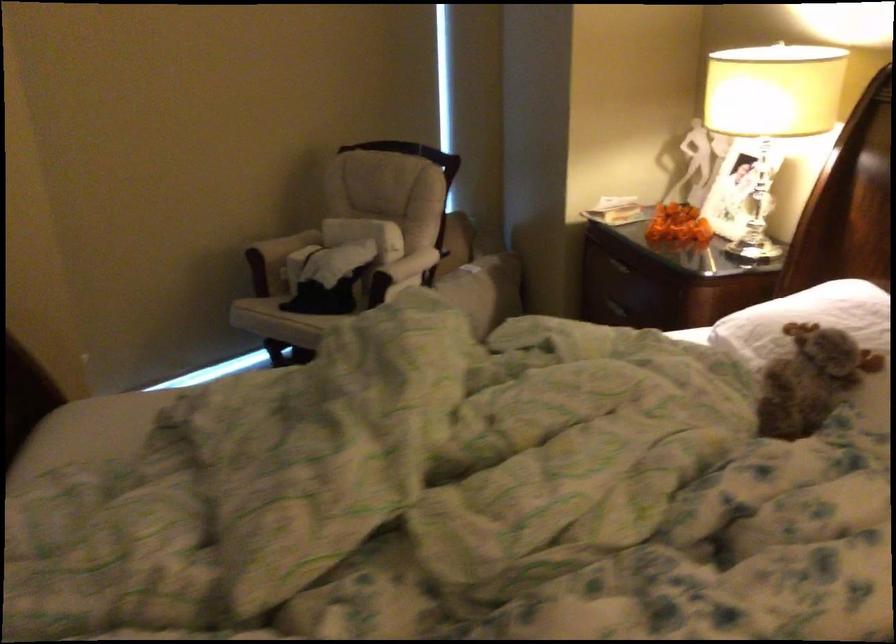
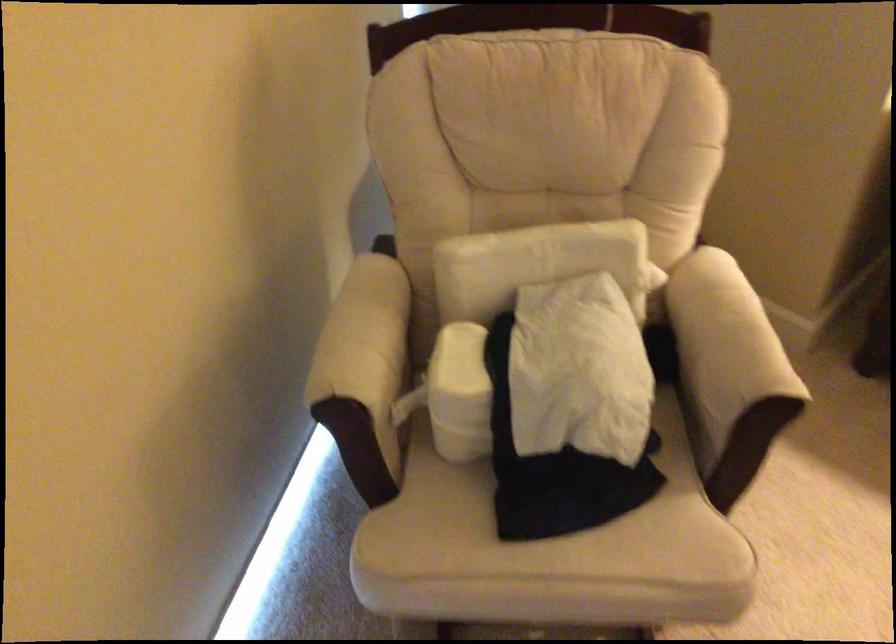
Where in the second image is the point corresponding to (x=293, y=310) from the first image?

(545, 535)